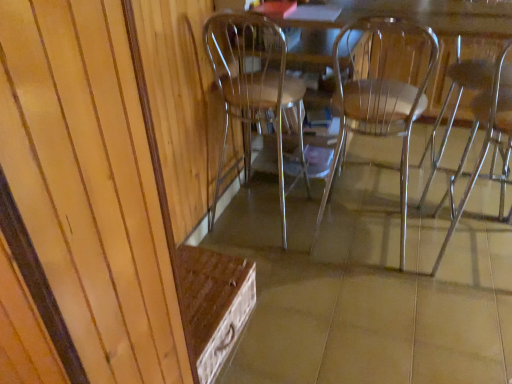
Image resolution: width=512 pixels, height=384 pixels. I want to click on clear plastic chair at center, the 2th chair in the right-to-left sequence, so click(375, 114).

Locate an element on the screen. This screenshot has height=384, width=512. clear plastic chair at right, which is counted as the 4th chair, starting from the left is located at coordinates (485, 125).

Is clear plastic chair at center, the fourth chair when ordered from right to left, aimed at clear plastic chair at center, the third chair viewed from the right?

No, clear plastic chair at center, the fourth chair when ordered from right to left, is not facing towards clear plastic chair at center, the third chair viewed from the right.

From a real-world perspective, is clear plastic chair at center, the fourth chair when ordered from right to left, below clear plastic chair at center, the third chair viewed from the right?

Correct, in the physical world, clear plastic chair at center, the fourth chair when ordered from right to left, is lower than clear plastic chair at center, the third chair viewed from the right.

Can you confirm if clear plastic chair at center, the fourth chair when ordered from right to left, is positioned to the right of clear plastic chair at center, the third chair viewed from the right?

In fact, clear plastic chair at center, the fourth chair when ordered from right to left, is to the left of clear plastic chair at center, the third chair viewed from the right.

Between point (262, 50) and point (362, 68), which one is positioned in front?

The point (262, 50) is in front.

Does clear plastic chair at center, which is the 3th chair from left to right, appear on the right side of clear plastic chair at right, which is counted as the 4th chair, starting from the left?

Incorrect, clear plastic chair at center, which is the 3th chair from left to right, is not on the right side of clear plastic chair at right, which is counted as the 4th chair, starting from the left.

From the image's perspective, would you say clear plastic chair at center, the 2th chair in the right-to-left sequence, is shown under clear plastic chair at right, which is counted as the 4th chair, starting from the left?

No, from the image's perspective, clear plastic chair at center, the 2th chair in the right-to-left sequence, is not beneath clear plastic chair at right, which is counted as the 4th chair, starting from the left.

Are clear plastic chair at center, which is the 3th chair from left to right, and clear plastic chair at right, positioned as the 1th chair in right-to-left order, located far from each other?

No.

Considering the relative sizes of clear plastic chair at center, which is the 3th chair from left to right, and clear plastic chair at right, positioned as the 1th chair in right-to-left order, in the image provided, is clear plastic chair at center, which is the 3th chair from left to right, wider than clear plastic chair at right, positioned as the 1th chair in right-to-left order,?

Correct, the width of clear plastic chair at center, which is the 3th chair from left to right, exceeds that of clear plastic chair at right, positioned as the 1th chair in right-to-left order.

Does clear plastic chair at center, the fourth chair when ordered from right to left, contain clear plastic chair at right, positioned as the 1th chair in right-to-left order?

No, clear plastic chair at right, positioned as the 1th chair in right-to-left order, is located outside of clear plastic chair at center, the fourth chair when ordered from right to left.

How different are the orientations of clear plastic chair at center, arranged as the 1th chair when viewed from the left, and clear plastic chair at right, which is counted as the 4th chair, starting from the left, in degrees?

The angular difference between clear plastic chair at center, arranged as the 1th chair when viewed from the left, and clear plastic chair at right, which is counted as the 4th chair, starting from the left, is 1.55 degrees.

Visually, is clear plastic chair at center, the fourth chair when ordered from right to left, positioned to the left or to the right of clear plastic chair at right, which is counted as the 4th chair, starting from the left?

clear plastic chair at center, the fourth chair when ordered from right to left, is to the left of clear plastic chair at right, which is counted as the 4th chair, starting from the left.

Is clear plastic chair at center, which is the second chair from left to right, taller than clear plastic chair at center, the fourth chair when ordered from right to left?

Yes, clear plastic chair at center, which is the second chair from left to right, is taller than clear plastic chair at center, the fourth chair when ordered from right to left.

Can you see clear plastic chair at center, which is the second chair from left to right, touching clear plastic chair at center, the fourth chair when ordered from right to left?

No, clear plastic chair at center, which is the second chair from left to right, is not touching clear plastic chair at center, the fourth chair when ordered from right to left.

Between clear plastic chair at center, which is the second chair from left to right, and clear plastic chair at center, arranged as the 1th chair when viewed from the left, which one has larger size?

Bigger between the two is clear plastic chair at center, which is the second chair from left to right.

How many degrees apart are the facing directions of clear plastic chair at center, which is the second chair from left to right, and clear plastic chair at center, arranged as the 1th chair when viewed from the left?

They differ by 2.23 degrees in their facing directions.

From the picture: From a real-world perspective, is clear plastic chair at right, which is counted as the 4th chair, starting from the left, on clear plastic chair at center, the 2th chair in the right-to-left sequence?

Yes, from a real-world perspective, clear plastic chair at right, which is counted as the 4th chair, starting from the left, is over clear plastic chair at center, the 2th chair in the right-to-left sequence

The height and width of the screenshot is (384, 512). What are the coordinates of `the 2nd chair behind the clear plastic chair at right, which is counted as the 4th chair, starting from the left, counting from the anchor's position` in the screenshot? It's located at (375, 114).

From the image's perspective, who appears lower, clear plastic chair at right, which is counted as the 4th chair, starting from the left, or clear plastic chair at center, which is the 3th chair from left to right?

clear plastic chair at right, which is counted as the 4th chair, starting from the left, from the image's perspective.

From the image's perspective, is clear plastic chair at center, the third chair viewed from the right, above or below clear plastic chair at center, which is the 3th chair from left to right?

Based on their image positions, clear plastic chair at center, the third chair viewed from the right, is located beneath clear plastic chair at center, which is the 3th chair from left to right.

Considering the relative positions of clear plastic chair at center, which is the second chair from left to right, and clear plastic chair at center, which is the 3th chair from left to right, in the image provided, is clear plastic chair at center, which is the second chair from left to right, to the right of clear plastic chair at center, which is the 3th chair from left to right, from the viewer's perspective?

No, clear plastic chair at center, which is the second chair from left to right, is not to the right of clear plastic chair at center, which is the 3th chair from left to right.

Consider the image. Between clear plastic chair at center, the third chair viewed from the right, and clear plastic chair at center, the 2th chair in the right-to-left sequence, which one has larger width?

Wider between the two is clear plastic chair at center, the 2th chair in the right-to-left sequence.

Is clear plastic chair at center, which is the second chair from left to right, beside clear plastic chair at center, the 2th chair in the right-to-left sequence?

No, clear plastic chair at center, which is the second chair from left to right, is not beside clear plastic chair at center, the 2th chair in the right-to-left sequence.

Is clear plastic chair at center, the 2th chair in the right-to-left sequence, not within clear plastic chair at center, the third chair viewed from the right?

Indeed, clear plastic chair at center, the 2th chair in the right-to-left sequence, is completely outside clear plastic chair at center, the third chair viewed from the right.

Which object is positioned more to the right, clear plastic chair at center, the 2th chair in the right-to-left sequence, or clear plastic chair at center, the third chair viewed from the right?

clear plastic chair at center, the 2th chair in the right-to-left sequence.

From the image's perspective, which chair is the 2nd one above the clear plastic chair at center, the third chair viewed from the right? Please provide its 2D coordinates.

[(375, 114)]

Does clear plastic chair at center, the 2th chair in the right-to-left sequence, turn towards clear plastic chair at center, the third chair viewed from the right?

No, clear plastic chair at center, the 2th chair in the right-to-left sequence, is not turned towards clear plastic chair at center, the third chair viewed from the right.

Which chair is the 2nd one when counting from the back of the clear plastic chair at center, which is the second chair from left to right? Please provide its 2D coordinates.

[(254, 88)]

Locate an element on the screen. The height and width of the screenshot is (384, 512). chair located on the right of clear plastic chair at center, the 2th chair in the right-to-left sequence is located at coordinates pyautogui.click(x=485, y=125).

Considering their positions, is clear plastic chair at right, which is counted as the 4th chair, starting from the left, positioned closer to clear plastic chair at center, which is the 3th chair from left to right, than clear plastic chair at center, which is the second chair from left to right?

clear plastic chair at right, which is counted as the 4th chair, starting from the left.

Estimate the real-world distances between objects in this image. Which object is further from clear plastic chair at center, the third chair viewed from the right, clear plastic chair at right, positioned as the 1th chair in right-to-left order, or clear plastic chair at center, arranged as the 1th chair when viewed from the left?

Based on the image, clear plastic chair at center, arranged as the 1th chair when viewed from the left, appears to be further to clear plastic chair at center, the third chair viewed from the right.

Looking at the image, which one is located closer to clear plastic chair at center, the fourth chair when ordered from right to left, clear plastic chair at right, which is counted as the 4th chair, starting from the left, or clear plastic chair at center, the third chair viewed from the right?

Based on the image, clear plastic chair at center, the third chair viewed from the right, appears to be nearer to clear plastic chair at center, the fourth chair when ordered from right to left.

From the picture: Estimate the real-world distances between objects in this image. Which object is further from clear plastic chair at right, which is counted as the 4th chair, starting from the left, clear plastic chair at center, which is the second chair from left to right, or clear plastic chair at center, arranged as the 1th chair when viewed from the left?

Among the two, clear plastic chair at center, arranged as the 1th chair when viewed from the left, is located further to clear plastic chair at right, which is counted as the 4th chair, starting from the left.

Based on their spatial positions, is clear plastic chair at center, which is the 3th chair from left to right, or clear plastic chair at center, the third chair viewed from the right, further from clear plastic chair at center, arranged as the 1th chair when viewed from the left?

Based on the image, clear plastic chair at center, the third chair viewed from the right, appears to be further to clear plastic chair at center, arranged as the 1th chair when viewed from the left.

Based on their spatial positions, is clear plastic chair at center, the third chair viewed from the right, or clear plastic chair at right, positioned as the 1th chair in right-to-left order, further from clear plastic chair at center, arranged as the 1th chair when viewed from the left?

The object further to clear plastic chair at center, arranged as the 1th chair when viewed from the left, is clear plastic chair at right, positioned as the 1th chair in right-to-left order.

Which object lies nearer to the anchor point clear plastic chair at center, the third chair viewed from the right, clear plastic chair at center, the 2th chair in the right-to-left sequence, or clear plastic chair at right, which is counted as the 4th chair, starting from the left?

clear plastic chair at center, the 2th chair in the right-to-left sequence, lies closer to clear plastic chair at center, the third chair viewed from the right, than the other object.

When comparing their distances from clear plastic chair at center, which is the second chair from left to right, does clear plastic chair at right, which is counted as the 4th chair, starting from the left, or clear plastic chair at center, which is the 3th chair from left to right, seem closer?

Among the two, clear plastic chair at center, which is the 3th chair from left to right, is located nearer to clear plastic chair at center, which is the second chair from left to right.

The image size is (512, 384). What are the coordinates of `chair between clear plastic chair at center, the fourth chair when ordered from right to left, and clear plastic chair at center, which is the 3th chair from left to right, in the horizontal direction` in the screenshot? It's located at (381, 91).

Where is `chair between clear plastic chair at center, which is the second chair from left to right, and clear plastic chair at right, positioned as the 1th chair in right-to-left order, in the horizontal direction`? The width and height of the screenshot is (512, 384). chair between clear plastic chair at center, which is the second chair from left to right, and clear plastic chair at right, positioned as the 1th chair in right-to-left order, in the horizontal direction is located at coordinates (375, 114).